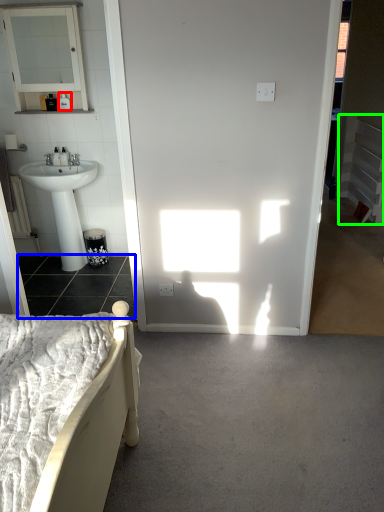
Question: Estimate the real-world distances between objects in this image. Which object is closer to toiletry (highlighted by a red box), concrete (highlighted by a blue box) or balustrade (highlighted by a green box)?

Choices:
 (A) concrete
 (B) balustrade

Answer: (A)